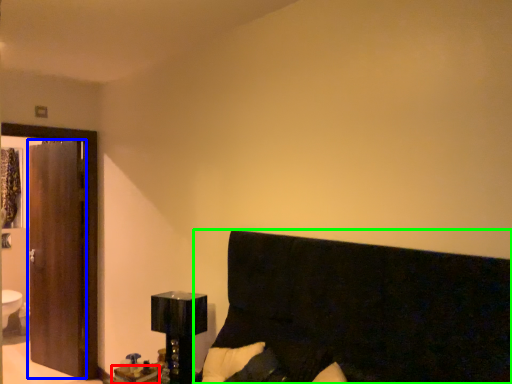
Question: Considering the real-world distances, which object is closest to table (highlighted by a red box)? screen door (highlighted by a blue box) or furniture (highlighted by a green box).

Choices:
 (A) screen door
 (B) furniture

Answer: (B)